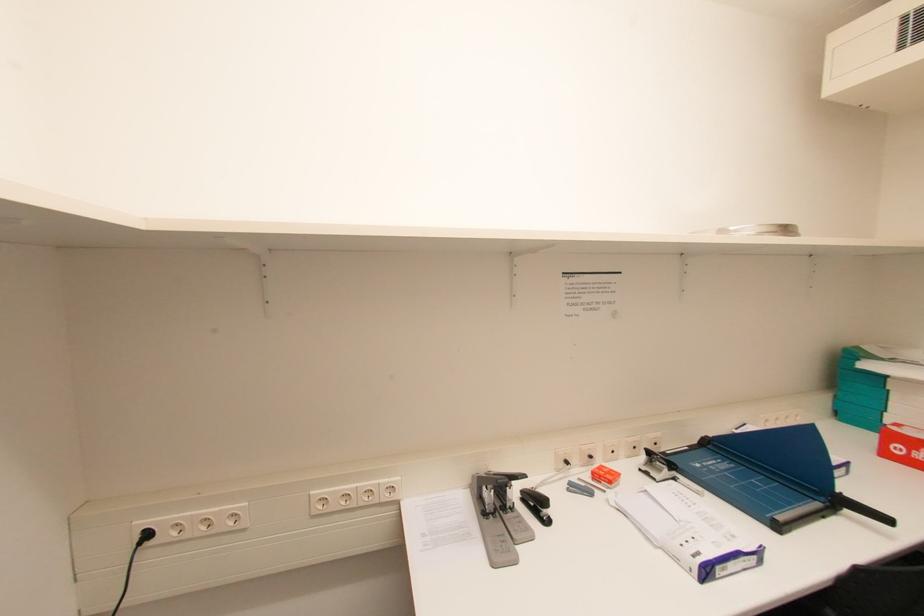
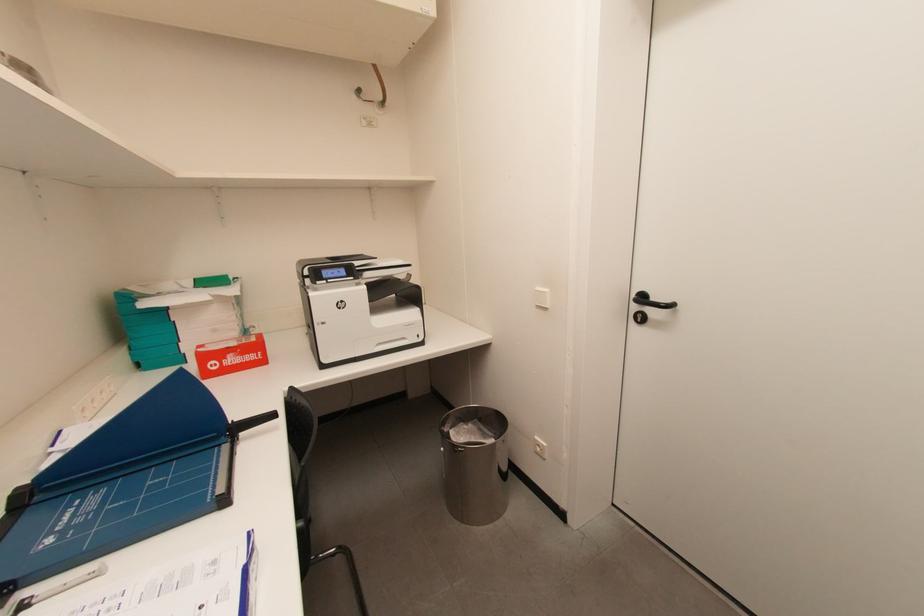
In the scene shown: First-person continuous shooting, in which direction is the camera rotating?

The camera's rotation is toward right-down.